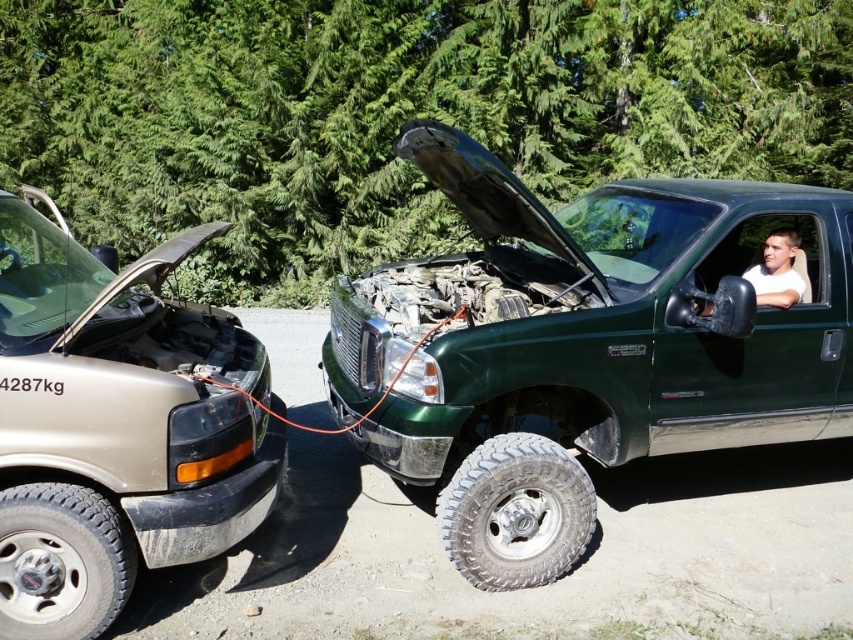
Question: Which point is farther from the camera taking this photo?

Choices:
 (A) (401, 364)
 (B) (488, 584)

Answer: (B)

Question: Is matte black truck at left above silver metallic tire at lower center?

Choices:
 (A) yes
 (B) no

Answer: (A)

Question: Can you confirm if matte black truck at left is thinner than black rubber tire at lower left?

Choices:
 (A) no
 (B) yes

Answer: (A)

Question: Does green matte truck at center have a larger size compared to black rubber tire at lower left?

Choices:
 (A) no
 (B) yes

Answer: (B)

Question: Which object is farther from the camera taking this photo?

Choices:
 (A) silver metallic tire at lower center
 (B) matte black truck at left

Answer: (A)

Question: Which point is farther to the camera?

Choices:
 (A) (253, 516)
 (B) (22, 627)

Answer: (A)